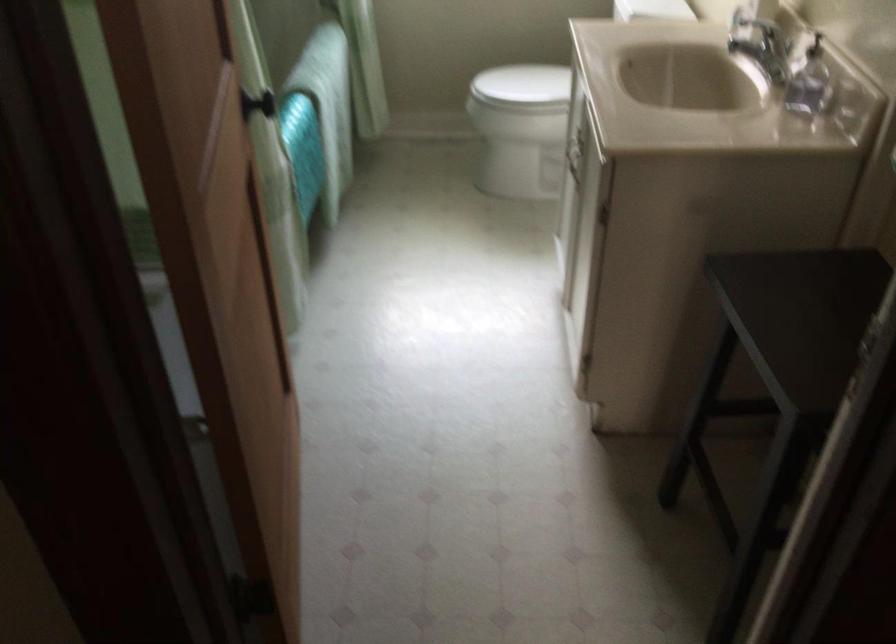
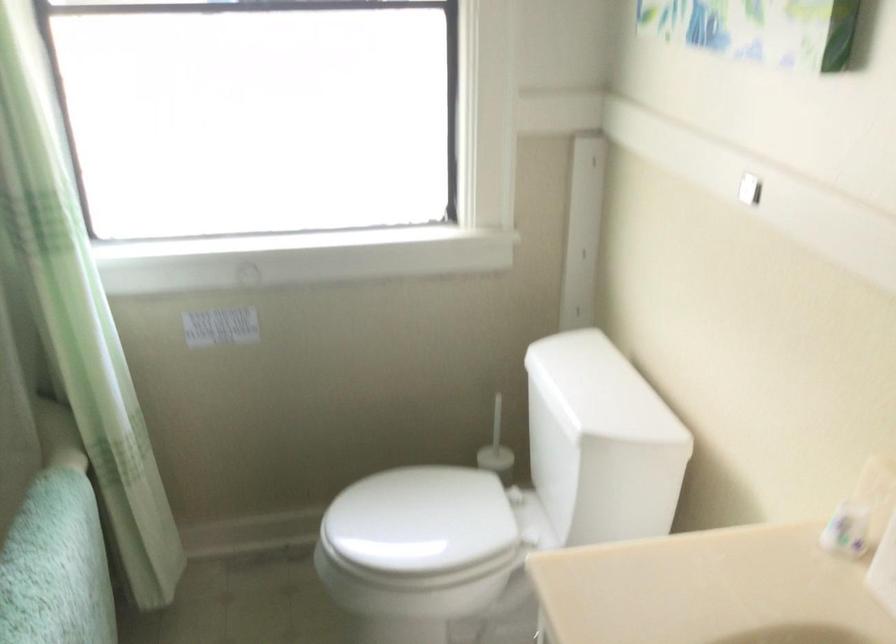
Locate, in the second image, the point that corresponds to point (529, 88) in the first image.

(419, 526)